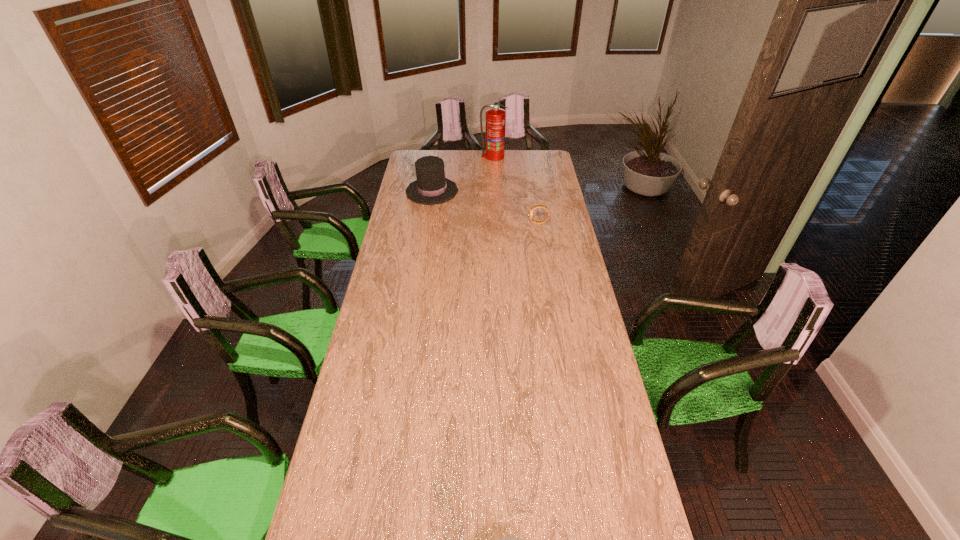
What are the coordinates of `free space between the third farthest object and the dress hat` in the screenshot? It's located at (485, 207).

Locate an element on the screen. Image resolution: width=960 pixels, height=540 pixels. free area in between the rightmost object and the fire extinguisher is located at coordinates (516, 190).

I want to click on vacant point located between the dress hat and the farthest object, so click(463, 174).

Choose which object is the nearest neighbor to the farthest object. Please provide its 2D coordinates. Your answer should be formatted as a tuple, i.e. [(x, y)], where the tuple contains the x and y coordinates of a point satisfying the conditions above.

[(431, 187)]

Choose which object is the nearest neighbor to the third shortest object. Please provide its 2D coordinates. Your answer should be formatted as a tuple, i.e. [(x, y)], where the tuple contains the x and y coordinates of a point satisfying the conditions above.

[(494, 148)]

You are a GUI agent. You are given a task and a screenshot of the screen. Output one action in this format:
    pyautogui.click(x=<x>, y=<y>)
    Task: Click on the vacant space that satisfies the following two spatial constraints: 1. on the instruction side of the fire extinguisher; 2. on the front of the third nearest object with the decoration
    Image resolution: width=960 pixels, height=540 pixels.
    Given the screenshot: What is the action you would take?
    pyautogui.click(x=495, y=191)

I want to click on vacant region that satisfies the following two spatial constraints: 1. on the instruction side of the tallest object; 2. on the front of the dress hat with the decoration, so click(495, 191).